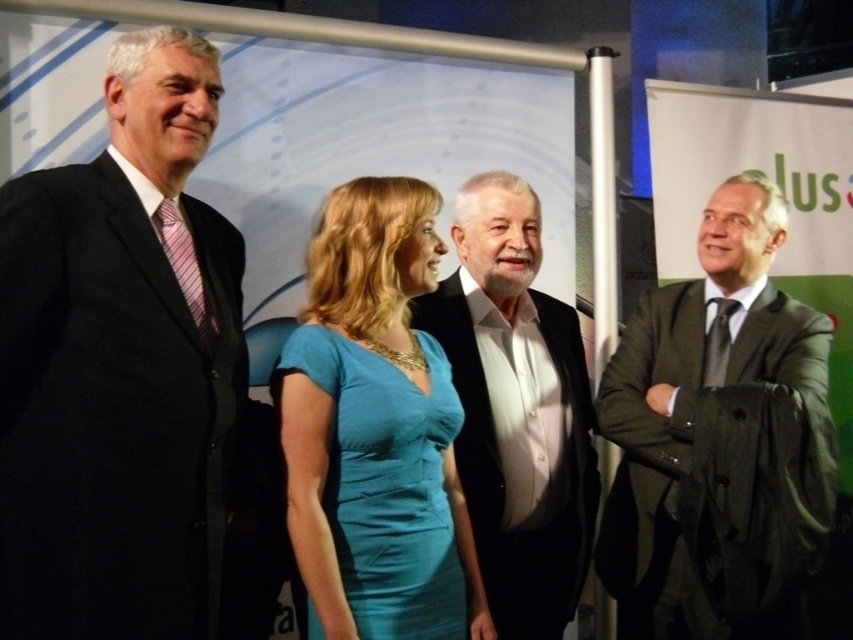
You are a photographer standing at the camera position. You want to take a photo of the group, but you need to ensure that the point at coordinates point [740,378] is within the frame. Given that your camera has a focal length of 50mm and a sensor size of 24mm x 36mm, can you confirm if this point will be in the field of view?

The point at coordinates point [740,378] is 2.12 meters away from the camera. Using the camera specifications, the field of view can be calculated. However, without knowing the exact position of the group relative to the camera or the sensor dimensions in relation to the coordinates, it is impossible to determine if the point will be within the frame.

You are organizing a photo shoot and need to arrange two outfits for a photoshoot setup. The outfits are the dark gray suit at right and the teal satin dress at center. Given their sizes, which outfit requires more horizontal space to display properly?

The dark gray suit at right requires more horizontal space to display properly since its width surpasses that of the teal satin dress at center.